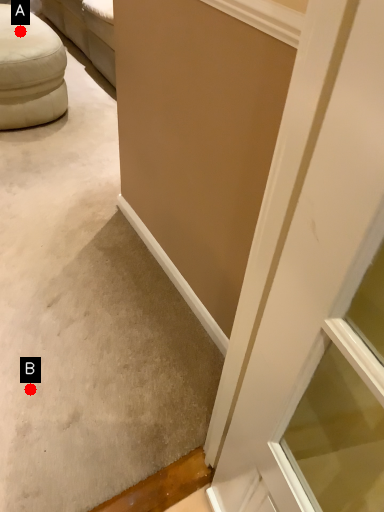
Question: Two points are circled on the image, labeled by A and B beside each circle. Among these points, which one is nearest to the camera?

Choices:
 (A) A is closer
 (B) B is closer

Answer: (B)